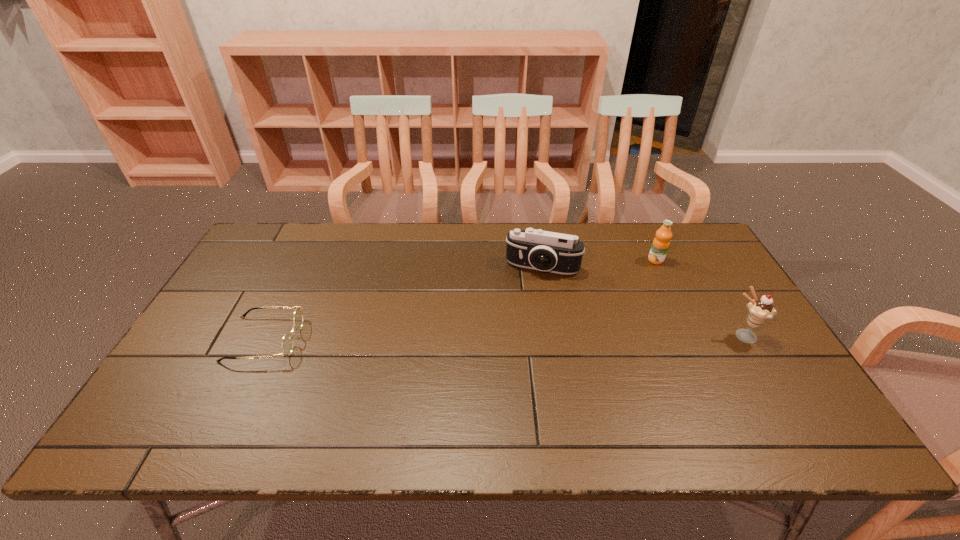
In order to click on free space located 0.390m on the label of the second object from right to left in this screenshot , I will do `click(564, 318)`.

You are a GUI agent. You are given a task and a screenshot of the screen. Output one action in this format:
    pyautogui.click(x=<x>, y=<y>)
    Task: Click on the free space located 0.340m on the label of the second object from right to left
    Image resolution: width=960 pixels, height=540 pixels.
    Given the screenshot: What is the action you would take?
    pyautogui.click(x=577, y=310)

Locate an element on the screen. free spot located 0.250m on the label of the second object from right to left is located at coordinates (598, 296).

I want to click on camera present at the far edge, so click(x=559, y=253).

Where is `orange juice located at the far edge`? The width and height of the screenshot is (960, 540). orange juice located at the far edge is located at coordinates (660, 245).

This screenshot has height=540, width=960. Find the location of `object that is at the left edge`. object that is at the left edge is located at coordinates (287, 342).

Locate an element on the screen. This screenshot has width=960, height=540. object that is at the right edge is located at coordinates click(x=760, y=310).

In the image, there is a desktop. Where is `vacant space at the far edge`? The width and height of the screenshot is (960, 540). vacant space at the far edge is located at coordinates (454, 239).

In the image, there is a desktop. Identify the location of vacant space at the near edge. The image size is (960, 540). (494, 400).

Locate an element on the screen. vacant region at the left edge of the desktop is located at coordinates (278, 281).